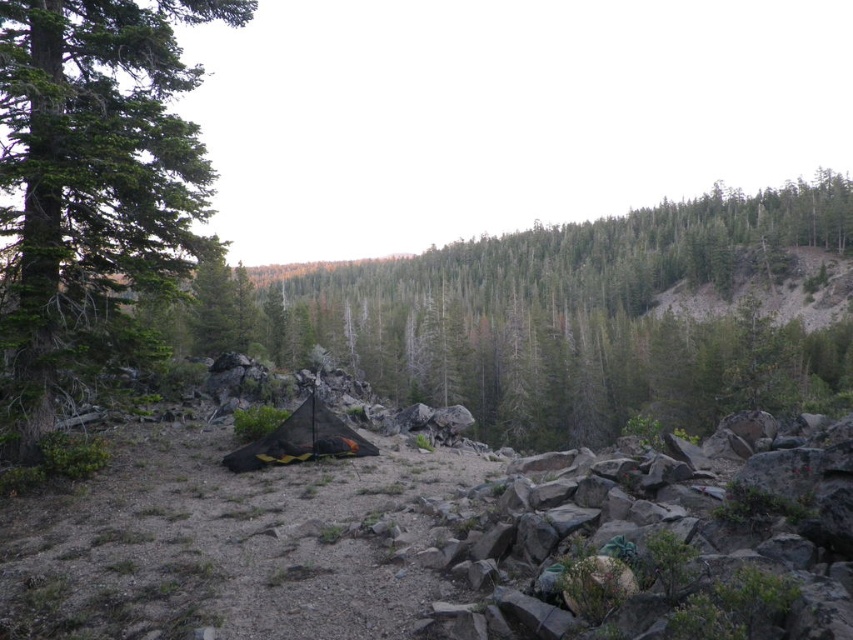
Question: Among these objects, which one is nearest to the camera?

Choices:
 (A) green matte tent at center
 (B) green textured tree at left

Answer: (B)

Question: Which point is farther to the camera?

Choices:
 (A) (306, 410)
 (B) (149, 65)

Answer: (A)

Question: Can you confirm if green matte tent at center is positioned to the left of green textured tree at left?

Choices:
 (A) no
 (B) yes

Answer: (A)

Question: Can you confirm if green matte tent at center is positioned below black mesh tent at center?

Choices:
 (A) no
 (B) yes

Answer: (A)

Question: Is green textured tree at left further to camera compared to black mesh tent at center?

Choices:
 (A) no
 (B) yes

Answer: (A)

Question: Estimate the real-world distances between objects in this image. Which object is closer to the green matte tent at center?

Choices:
 (A) black mesh tent at center
 (B) green textured tree at left

Answer: (A)